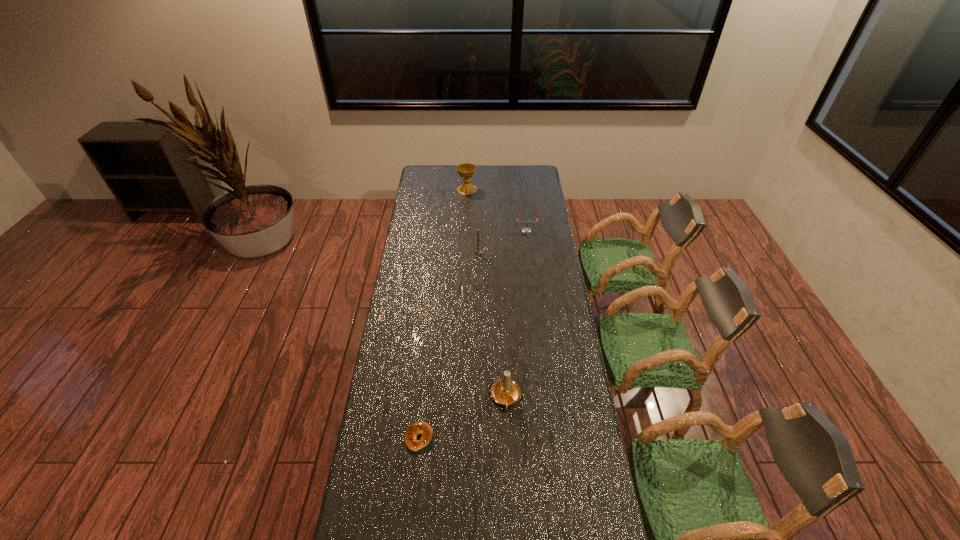
Identify which object is the second closest to the second object from right to left. Please provide its 2D coordinates. Your answer should be formatted as a tuple, i.e. [(x, y)], where the tuple contains the x and y coordinates of a point satisfying the conditions above.

[(478, 251)]

The width and height of the screenshot is (960, 540). What are the coordinates of `object that stands as the closest to the second shortest object` in the screenshot? It's located at (478, 251).

Choose which candle is the nearest neighbor to the farthest candle. Please provide its 2D coordinates. Your answer should be formatted as a tuple, i.e. [(x, y)], where the tuple contains the x and y coordinates of a point satisfying the conditions above.

[(478, 251)]

Identify which candle is the second nearest to the shortest object. Please provide its 2D coordinates. Your answer should be formatted as a tuple, i.e. [(x, y)], where the tuple contains the x and y coordinates of a point satisfying the conditions above.

[(478, 251)]

The width and height of the screenshot is (960, 540). Find the location of `free space that satisfies the following two spatial constraints: 1. on the back side of the bagel; 2. on the right side of the third nearest object`. free space that satisfies the following two spatial constraints: 1. on the back side of the bagel; 2. on the right side of the third nearest object is located at coordinates (438, 252).